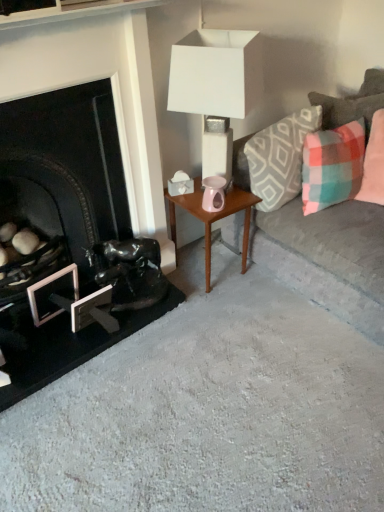
Find the location of a particular element. The height and width of the screenshot is (512, 384). plaid fabric pillow at right, which is the first pillow in right-to-left order is located at coordinates (374, 163).

What do you see at coordinates (216, 87) in the screenshot? I see `white matte table lamp at center` at bounding box center [216, 87].

The width and height of the screenshot is (384, 512). What are the coordinates of `plaid fabric pillow at right` in the screenshot? It's located at (332, 166).

Locate an element on the screen. Image resolution: width=384 pixels, height=512 pixels. wooden side table at center is located at coordinates (212, 218).

At what (x,y) coordinates should I click in order to perform the action: click on plaid fabric pillow at right, which is the first pillow in right-to-left order. Please return your answer as a coordinate pair (x, y). This screenshot has height=512, width=384. Looking at the image, I should click on (374, 163).

Which is in front, plaid fabric pillow at right, which is counted as the 3th pillow, starting from the left, or plaid fabric pillow at right?

plaid fabric pillow at right.

Is plaid fabric pillow at right, which is counted as the 3th pillow, starting from the left, positioned far away from plaid fabric pillow at right?

plaid fabric pillow at right, which is counted as the 3th pillow, starting from the left, is actually quite close to plaid fabric pillow at right.

The width and height of the screenshot is (384, 512). In order to click on throw pillow beneath the plaid fabric pillow at right, which is counted as the 3th pillow, starting from the left (from a real-world perspective) in this screenshot , I will do `click(332, 166)`.

Is plaid fabric pillow at right, which is counted as the 3th pillow, starting from the left, positioned beyond the bounds of plaid fabric pillow at right?

Yes, plaid fabric pillow at right, which is counted as the 3th pillow, starting from the left, is outside of plaid fabric pillow at right.

In the scene shown: From a real-world perspective, between plaid fabric pillow at upper right, the second pillow in the right-to-left sequence, and wooden side table at center, who is vertically lower?

wooden side table at center, from a real-world perspective.

Is plaid fabric pillow at upper right, the 2th pillow when ordered from left to right, positioned with its back to wooden side table at center?

No, plaid fabric pillow at upper right, the 2th pillow when ordered from left to right, is not facing away from wooden side table at center.

Is plaid fabric pillow at upper right, the second pillow in the right-to-left sequence, positioned behind wooden side table at center?

That is True.

From the image's perspective, would you say wooden side table at center is shown under plush gray couch at right?

Yes.

Is wooden side table at center oriented towards plush gray couch at right?

No, wooden side table at center is not facing towards plush gray couch at right.

Would you consider wooden side table at center to be distant from plush gray couch at right?

No.

In the scene shown: Considering the relative sizes of wooden side table at center and plush gray couch at right in the image provided, is wooden side table at center wider than plush gray couch at right?

In fact, wooden side table at center might be narrower than plush gray couch at right.

Considering the sizes of objects wooden side table at center and plaid fabric pillow at right, which is the first pillow in right-to-left order, in the image provided, who is wider, wooden side table at center or plaid fabric pillow at right, which is the first pillow in right-to-left order,?

wooden side table at center.

Can you confirm if wooden side table at center is positioned to the left of plaid fabric pillow at right, which is the first pillow in right-to-left order?

Yes.

Which is correct: wooden side table at center is inside plaid fabric pillow at right, which is counted as the 3th pillow, starting from the left, or outside of it?

wooden side table at center is located beyond the bounds of plaid fabric pillow at right, which is counted as the 3th pillow, starting from the left.

In the scene shown: From the image's perspective, is plaid fabric pillow at right above or below plaid fabric pillow at right, which is counted as the 3th pillow, starting from the left?

From the image's perspective, plaid fabric pillow at right appears below plaid fabric pillow at right, which is counted as the 3th pillow, starting from the left.

Is plaid fabric pillow at right wider than plaid fabric pillow at right, which is the first pillow in right-to-left order?

Yes, plaid fabric pillow at right is wider than plaid fabric pillow at right, which is the first pillow in right-to-left order.

Does point (318, 145) come behind point (375, 179)?

That is False.

Looking at this image, can shiny black sculpture at lower left be found inside plaid fabric pillow at right?

No.

Does plaid fabric pillow at right come behind shiny black sculpture at lower left?

No, plaid fabric pillow at right is closer to the viewer.

Between plaid fabric pillow at right and shiny black sculpture at lower left, which one appears on the left side from the viewer's perspective?

From the viewer's perspective, shiny black sculpture at lower left appears more on the left side.

Considering the sizes of objects plaid fabric pillow at right and shiny black sculpture at lower left in the image provided, who is taller, plaid fabric pillow at right or shiny black sculpture at lower left?

With more height is plaid fabric pillow at right.

Can you confirm if metallic silver picture frame at lower left is positioned to the left of wooden side table at center?

Yes, metallic silver picture frame at lower left is to the left of wooden side table at center.

You are a GUI agent. You are given a task and a screenshot of the screen. Output one action in this format:
    pyautogui.click(x=<x>, y=<y>)
    Task: Click on the picture frame in front of the wooden side table at center
    The image size is (384, 512).
    Given the screenshot: What is the action you would take?
    pyautogui.click(x=47, y=284)

In the scene shown: Who is taller, metallic silver picture frame at lower left or wooden side table at center?

Standing taller between the two is wooden side table at center.

I want to click on pillow that is the 1st one above the plaid fabric pillow at right (from a real-world perspective), so click(x=374, y=163).

Identify the location of pillow behind the wooden side table at center. (346, 108).

Considering their positions, is plaid fabric pillow at right, the 3th pillow in the right-to-left sequence, positioned closer to plaid fabric pillow at upper right, the 2th pillow when ordered from left to right, than plaid fabric pillow at right?

Among the two, plaid fabric pillow at right is located nearer to plaid fabric pillow at upper right, the 2th pillow when ordered from left to right.

Based on their spatial positions, is metallic silver picture frame at lower left or wooden side table at center closer to plaid fabric pillow at right, which is the first pillow in right-to-left order?

wooden side table at center is closer to plaid fabric pillow at right, which is the first pillow in right-to-left order.

When comparing their distances from plaid fabric pillow at right, positioned as the first pillow in left-to-right order, does plaid fabric pillow at right or plaid fabric pillow at upper right, the 2th pillow when ordered from left to right, seem further?

plaid fabric pillow at upper right, the 2th pillow when ordered from left to right, is positioned further to the anchor plaid fabric pillow at right, positioned as the first pillow in left-to-right order.

When comparing their distances from plush gray couch at right, does plaid fabric pillow at right, which is the first pillow in right-to-left order, or plaid fabric pillow at right, the 3th pillow in the right-to-left sequence, seem closer?

plaid fabric pillow at right, the 3th pillow in the right-to-left sequence.

Based on their spatial positions, is plaid fabric pillow at right, which is counted as the 3th pillow, starting from the left, or plaid fabric pillow at right, positioned as the first pillow in left-to-right order, closer to wooden side table at center?

Among the two, plaid fabric pillow at right, positioned as the first pillow in left-to-right order, is located nearer to wooden side table at center.

From the image, which object appears to be nearer to plaid fabric pillow at right, the 3th pillow in the right-to-left sequence, metallic silver picture frame at lower left or plush gray couch at right?

The object closer to plaid fabric pillow at right, the 3th pillow in the right-to-left sequence, is plush gray couch at right.

Looking at the image, which one is located closer to metallic silver picture frame at lower left, shiny black sculpture at lower left or plaid fabric pillow at right, the 3th pillow in the right-to-left sequence?

shiny black sculpture at lower left is positioned closer to the anchor metallic silver picture frame at lower left.

From the image, which object appears to be nearer to metallic silver picture frame at lower left, white matte table lamp at center or shiny black sculpture at lower left?

shiny black sculpture at lower left.

The width and height of the screenshot is (384, 512). I want to click on swivel chair between metallic silver picture frame at lower left and plaid fabric pillow at right, so click(129, 272).

I want to click on pillow between white matte table lamp at center and plaid fabric pillow at right, so click(280, 158).

Locate an element on the screen. throw pillow between metallic silver picture frame at lower left and plaid fabric pillow at right, which is counted as the 3th pillow, starting from the left is located at coordinates (332, 166).

Where is `table located between metallic silver picture frame at lower left and plaid fabric pillow at right, which is counted as the 3th pillow, starting from the left, in the left-right direction`? table located between metallic silver picture frame at lower left and plaid fabric pillow at right, which is counted as the 3th pillow, starting from the left, in the left-right direction is located at coordinates (212, 218).